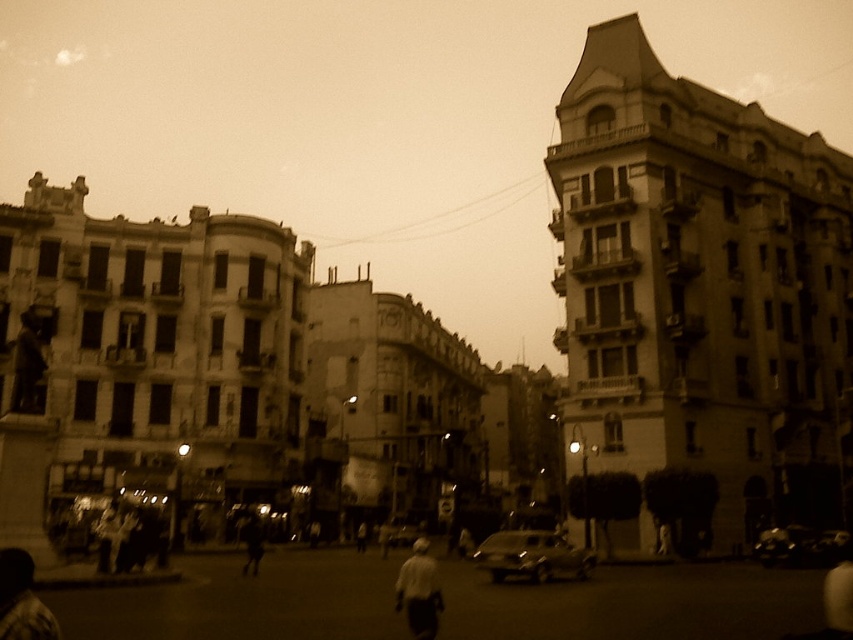
Question: Is the position of dark textured clothing at lower left less distant than that of white matte shirt at center?

Choices:
 (A) yes
 (B) no

Answer: (A)

Question: Estimate the real-world distances between objects in this image. Which object is closer to the dark textured clothing at lower left?

Choices:
 (A) dark gray fabric person at center
 (B) white matte shirt at center
 (C) shiny black car at center

Answer: (B)

Question: Which of the following is the farthest from the observer?

Choices:
 (A) dark gray fabric person at center
 (B) shiny black car at center

Answer: (B)

Question: Is white matte shirt at center bigger than shiny black car at center?

Choices:
 (A) no
 (B) yes

Answer: (B)

Question: Which point is farther to the camera?

Choices:
 (A) dark gray fabric person at center
 (B) metallic silver car at center
 (C) dark textured clothing at lower left
 (D) shiny black car at center

Answer: (D)

Question: Does metallic silver car at center appear on the right side of shiny black car at center?

Choices:
 (A) yes
 (B) no

Answer: (B)